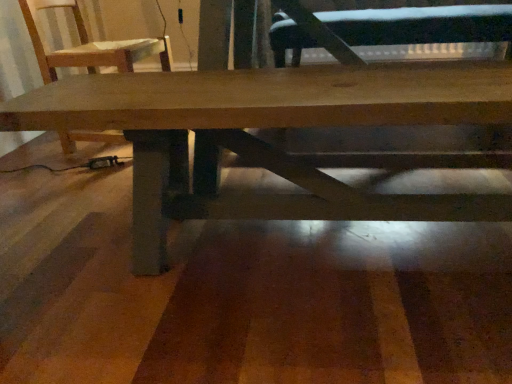
Locate an element on the screen. wooden chair at upper left is located at coordinates (89, 45).

At what (x,y) coordinates should I click in order to perform the action: click on black leather swivel chair at center. Please return your answer as a coordinate pair (x, y). Looking at the image, I should click on (421, 25).

From a real-world perspective, who is located higher, black leather swivel chair at center or wooden chair at upper left?

black leather swivel chair at center is physically above.

From the image's perspective, is black leather swivel chair at center on wooden chair at upper left?

Yes.

Does black leather swivel chair at center appear on the left side of wooden chair at upper left?

In fact, black leather swivel chair at center is to the right of wooden chair at upper left.

Would you consider black leather swivel chair at center to be distant from wooden chair at upper left?

No, black leather swivel chair at center is in close proximity to wooden chair at upper left.

The height and width of the screenshot is (384, 512). Find the location of `swivel chair above the natural wood table at center (from a real-world perspective)`. swivel chair above the natural wood table at center (from a real-world perspective) is located at coordinates (421, 25).

Does point (25, 94) come farther from viewer compared to point (294, 61)?

No, (25, 94) is closer to viewer.

Between natural wood table at center and black leather swivel chair at center, which one has more height?

Standing taller between the two is natural wood table at center.

Considering the sizes of objects natural wood table at center and black leather swivel chair at center in the image provided, who is thinner, natural wood table at center or black leather swivel chair at center?

Thinner between the two is natural wood table at center.

Who is smaller, wooden chair at upper left or black leather swivel chair at center?

Smaller between the two is wooden chair at upper left.

Between wooden chair at upper left and black leather swivel chair at center, which one appears on the right side from the viewer's perspective?

black leather swivel chair at center.

Which object is closer to the camera taking this photo, wooden chair at upper left or black leather swivel chair at center?

wooden chair at upper left is in front.

Which is correct: wooden chair at upper left is inside black leather swivel chair at center, or outside of it?

wooden chair at upper left cannot be found inside black leather swivel chair at center.

Considering the relative sizes of natural wood table at center and wooden chair at upper left in the image provided, is natural wood table at center smaller than wooden chair at upper left?

Incorrect, natural wood table at center is not smaller in size than wooden chair at upper left.

From a real-world perspective, is natural wood table at center located beneath wooden chair at upper left?

Yes.

Considering the sizes of objects natural wood table at center and wooden chair at upper left in the image provided, who is shorter, natural wood table at center or wooden chair at upper left?

natural wood table at center.

Is black leather swivel chair at center facing away from natural wood table at center?

No, black leather swivel chair at center's orientation is not away from natural wood table at center.

In the scene shown: How distant is black leather swivel chair at center from natural wood table at center?

black leather swivel chair at center and natural wood table at center are 1.03 meters apart from each other.

From a real-world perspective, which is physically below, black leather swivel chair at center or natural wood table at center?

natural wood table at center.

Would you say natural wood table at center is part of black leather swivel chair at center's contents?

Definitely not — natural wood table at center is not inside black leather swivel chair at center.

Which of these two, wooden chair at upper left or natural wood table at center, is wider?

wooden chair at upper left is wider.

Based on the photo, from a real-world perspective, relative to natural wood table at center, is wooden chair at upper left vertically above or below?

In terms of real-world spatial position, wooden chair at upper left is above natural wood table at center.

Is wooden chair at upper left oriented towards natural wood table at center?

No, wooden chair at upper left is not facing towards natural wood table at center.

In terms of size, does wooden chair at upper left appear bigger or smaller than natural wood table at center?

wooden chair at upper left is smaller than natural wood table at center.

Identify the location of swivel chair behind the wooden chair at upper left. The width and height of the screenshot is (512, 384). point(421,25).

Locate an element on the screen. The height and width of the screenshot is (384, 512). table in front of the black leather swivel chair at center is located at coordinates click(x=267, y=126).

Which object lies further to the anchor point black leather swivel chair at center, natural wood table at center or wooden chair at upper left?

Based on the image, natural wood table at center appears to be further to black leather swivel chair at center.

Which object lies nearer to the anchor point natural wood table at center, wooden chair at upper left or black leather swivel chair at center?

wooden chair at upper left is positioned closer to the anchor natural wood table at center.

Based on their spatial positions, is black leather swivel chair at center or natural wood table at center further from wooden chair at upper left?

Result: black leather swivel chair at center is further to wooden chair at upper left.

When comparing their distances from black leather swivel chair at center, does wooden chair at upper left or natural wood table at center seem closer?

wooden chair at upper left is positioned closer to the anchor black leather swivel chair at center.

Which object lies further to the anchor point natural wood table at center, black leather swivel chair at center or wooden chair at upper left?

black leather swivel chair at center is positioned further to the anchor natural wood table at center.

Looking at the image, which one is located closer to wooden chair at upper left, natural wood table at center or black leather swivel chair at center?

Based on the image, natural wood table at center appears to be nearer to wooden chair at upper left.

Where is `table between wooden chair at upper left and black leather swivel chair at center`? The height and width of the screenshot is (384, 512). table between wooden chair at upper left and black leather swivel chair at center is located at coordinates (267, 126).